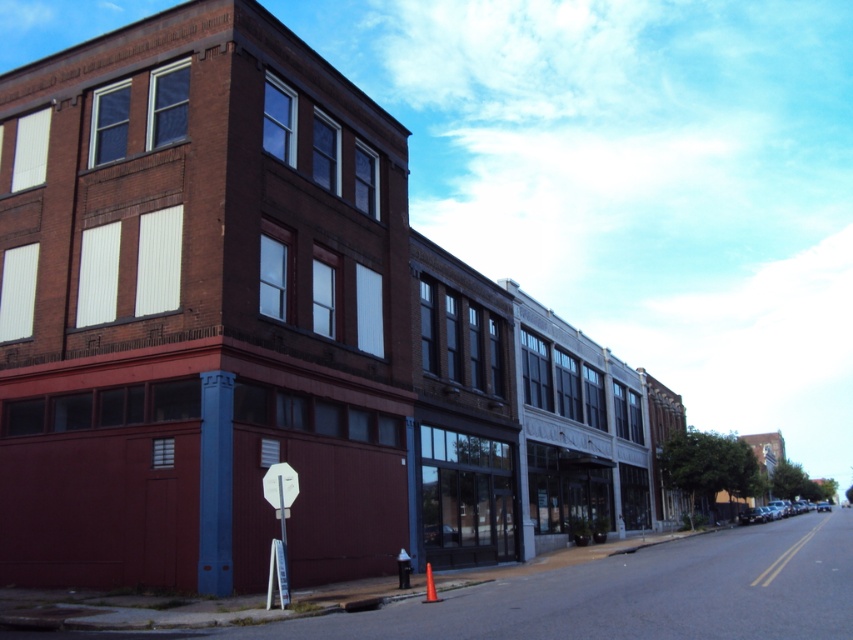
You are a pedestrian standing on the sidewalk and want to know if the white plastic stop sign at center is located above or below the metallic pole at center. Based on the scene, can you determine its position?

The white plastic stop sign at center is positioned under the metallic pole at center, so it is located below the pole.

You are standing at the edge of the sidewalk and see the white plastic stop sign at center. If you walk straight towards it, how far will you have to walk to reach it?

The white plastic stop sign at center is 41.61 feet away from the camera, so you will have to walk 41.61 feet to reach it.

You are driving a car and see the white plastic stop sign at center and the metallic pole at center. Which object is closer to you?

The white plastic stop sign at center is closer to you because it is in front of the metallic pole at center.